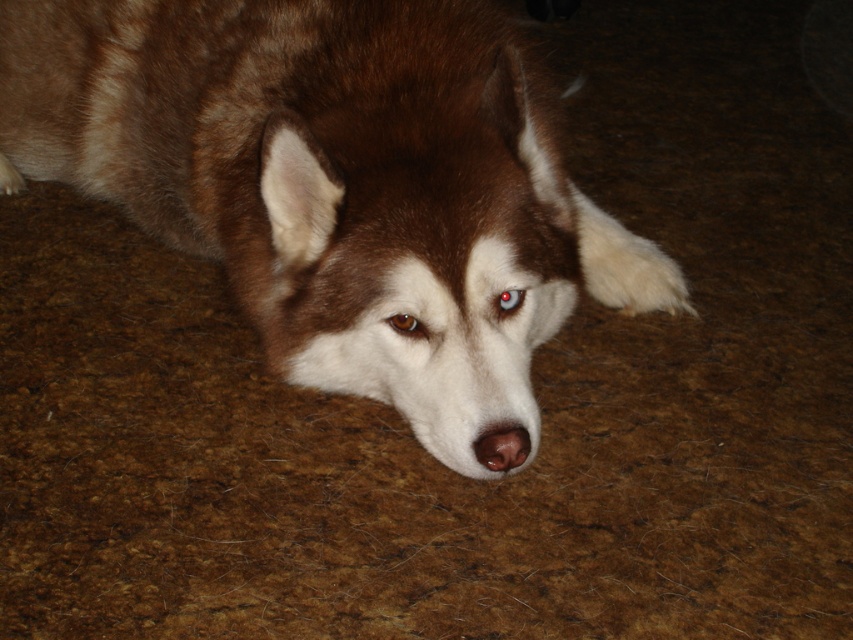
Between brown fur dog at center and brown glossy eye at center, which one appears on the right side from the viewer's perspective?

brown glossy eye at center is more to the right.

Does brown fur dog at center have a lesser height compared to brown glossy eye at center?

No.

You are a GUI agent. You are given a task and a screenshot of the screen. Output one action in this format:
    pyautogui.click(x=<x>, y=<y>)
    Task: Click on the brown fur dog at center
    The height and width of the screenshot is (640, 853).
    Given the screenshot: What is the action you would take?
    pyautogui.click(x=335, y=182)

Where is `brown fur dog at center`? Image resolution: width=853 pixels, height=640 pixels. brown fur dog at center is located at coordinates (335, 182).

Between brown glossy eye at center and shiny brown eye at center, which one is positioned lower?

Positioned lower is brown glossy eye at center.

Is brown glossy eye at center shorter than shiny brown eye at center?

Indeed, brown glossy eye at center has a lesser height compared to shiny brown eye at center.

Does point (409, 333) come in front of point (503, 294)?

Yes, point (409, 333) is closer to viewer.

The width and height of the screenshot is (853, 640). I want to click on brown glossy eye at center, so click(407, 324).

Is brown fur dog at center positioned behind shiny brown eye at center?

No.

You are a GUI agent. You are given a task and a screenshot of the screen. Output one action in this format:
    pyautogui.click(x=<x>, y=<y>)
    Task: Click on the brown fur dog at center
    
    Given the screenshot: What is the action you would take?
    pyautogui.click(x=335, y=182)

Identify the location of brown fur dog at center. click(335, 182).